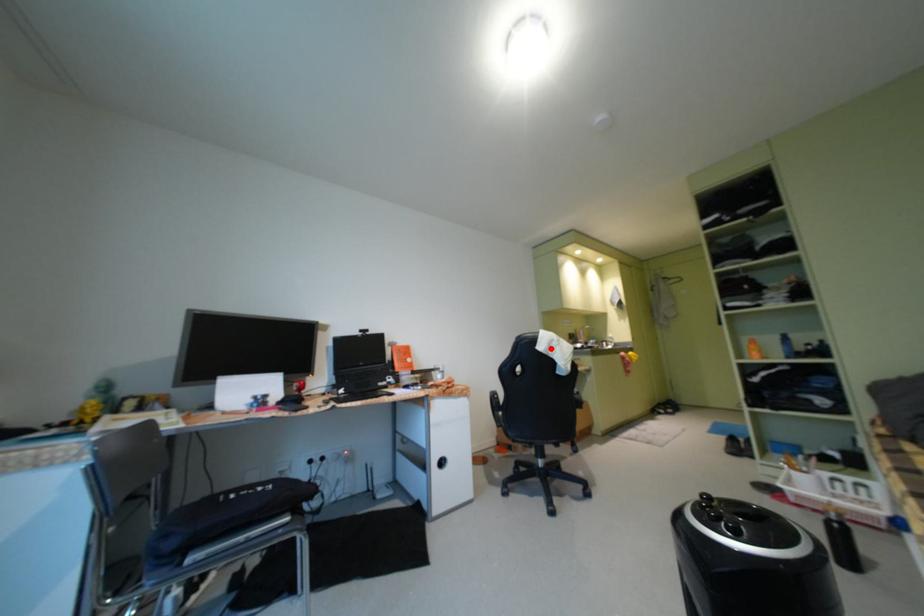
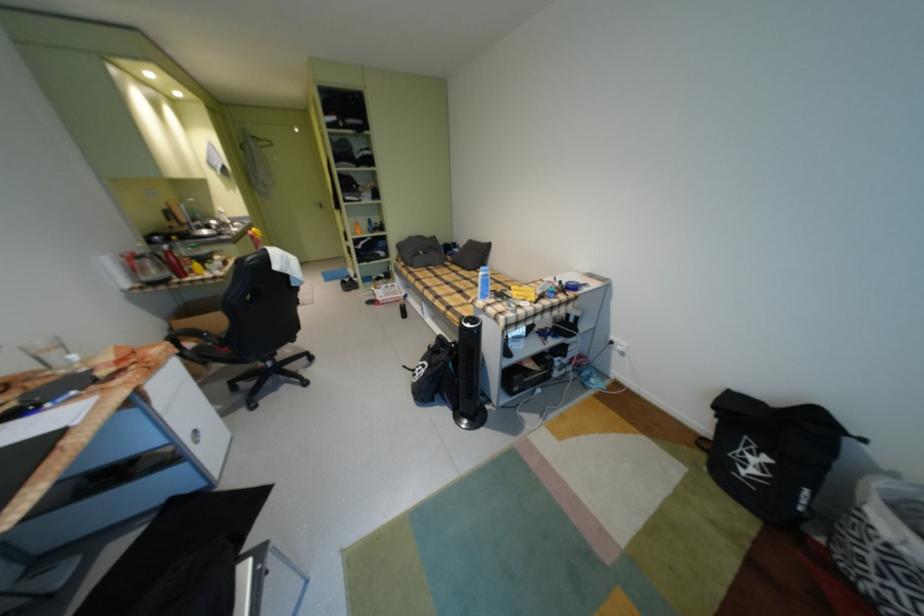
Locate, in the second image, the point that corresponds to the highlighted location in the first image.

(286, 268)